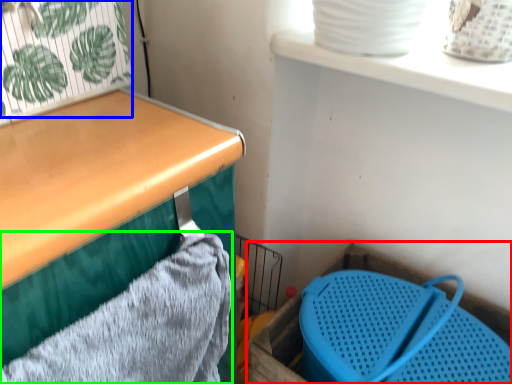
Question: Based on their relative distances, which object is nearer to storage box (highlighted by a red box)? Choose from plant (highlighted by a blue box) and bath towel (highlighted by a green box).

Choices:
 (A) plant
 (B) bath towel

Answer: (B)